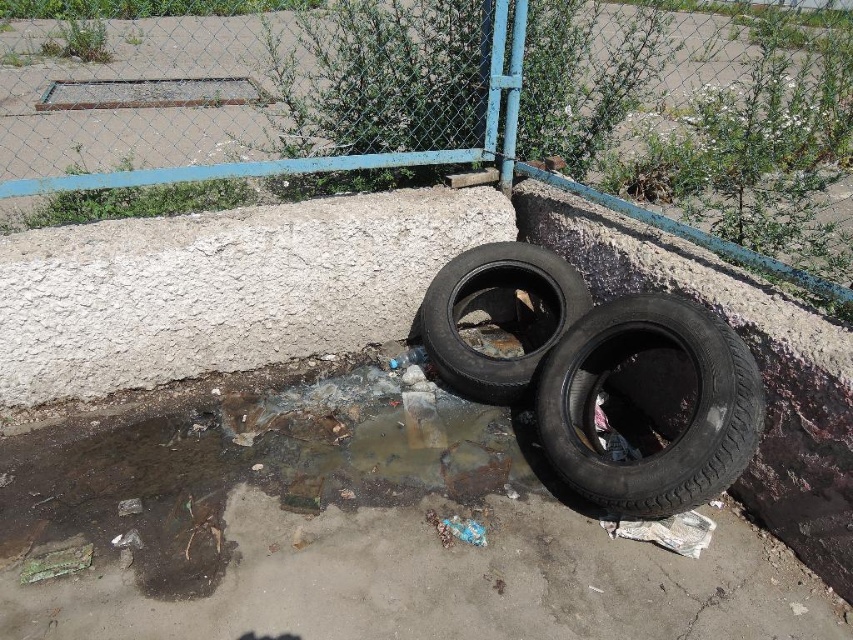
You are standing in the scene and want to place a small plant in the exact location of the point marked at coordinates point (456, 106). Based on the scene description, what object will the plant be placed on?

The point (456, 106) is on the rusty metal fence at upper center, so the plant will be placed on the rusty metal fence at upper center.

From the picture: You are a maintenance worker who needs to clean up the black rubber tire at lower right and the brown mud puddle at lower center. If your cleaning tool has a maximum reach of 25 inches, can you clean both areas without moving the tool?

The distance between the black rubber tire at lower right and the brown mud puddle at lower center is 26.17 inches. Since the tool can only reach up to 25 inches, you would need to move the tool to clean both areas.

You are a city inspector evaluating the scene. You need to determine if the rusty metal fence at upper center is positioned to the right of the brown mud puddle at lower center. Based on the spatial arrangement in the image, what is your observation?

The rusty metal fence at upper center is to the right of the brown mud puddle at lower center.